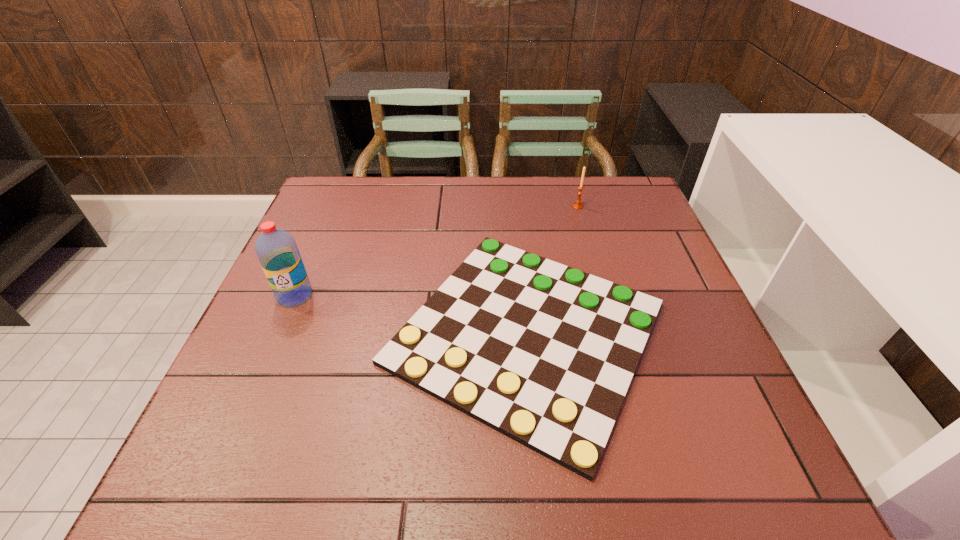
The image size is (960, 540). I want to click on the leftmost object, so click(x=277, y=251).

I want to click on the tallest object, so tap(277, 251).

Identify the location of the farthest object. The width and height of the screenshot is (960, 540). (577, 205).

Find the location of a particular element. The height and width of the screenshot is (540, 960). the second tallest object is located at coordinates (577, 205).

Locate an element on the screen. checkerboard is located at coordinates (543, 353).

At what (x,y) coordinates should I click in order to perform the action: click on vacant space located 0.370m on the front label of the water bottle. Please return your answer as a coordinate pair (x, y). The image size is (960, 540). Looking at the image, I should click on (220, 471).

Find the location of a particular element. free spot located on the left of the second shortest object is located at coordinates (498, 206).

This screenshot has height=540, width=960. What are the coordinates of `free space located on the back of the shortest object` in the screenshot? It's located at (513, 197).

Where is `object located in the far edge section of the desktop`? Image resolution: width=960 pixels, height=540 pixels. object located in the far edge section of the desktop is located at coordinates (577, 205).

The width and height of the screenshot is (960, 540). In order to click on object that is at the near edge in this screenshot , I will do `click(543, 353)`.